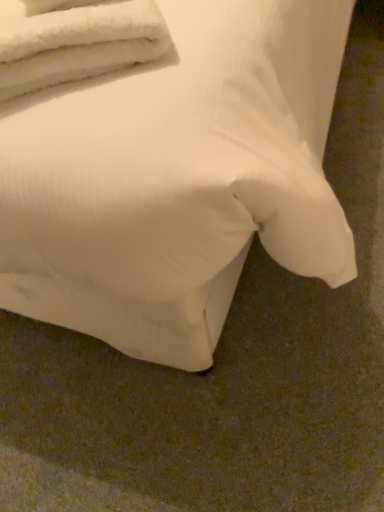
Image resolution: width=384 pixels, height=512 pixels. Describe the element at coordinates (176, 179) in the screenshot. I see `white fabric bed at center` at that location.

At what (x,y) coordinates should I click in order to perform the action: click on white fabric bed at center. Please return your answer as a coordinate pair (x, y). The height and width of the screenshot is (512, 384). Looking at the image, I should click on (176, 179).

Measure the distance between point (0, 91) and camera.

They are 60.60 centimeters apart.

This screenshot has width=384, height=512. What do you see at coordinates (78, 44) in the screenshot?
I see `white fluffy towels at upper left` at bounding box center [78, 44].

What is the approximate width of white fluffy towels at upper left?

14.81 inches.

Locate an element on the screen. white fluffy towels at upper left is located at coordinates (78, 44).

Locate an element on the screen. The image size is (384, 512). white fabric bed at center is located at coordinates (176, 179).

Which object is positioned more to the right, white fabric bed at center or white fluffy towels at upper left?

From the viewer's perspective, white fabric bed at center appears more on the right side.

Is white fabric bed at center behind white fluffy towels at upper left?

No, white fabric bed at center is closer to the camera.

Is point (80, 262) more distant than point (109, 12)?

Yes, it is behind point (109, 12).

From the image's perspective, who appears lower, white fabric bed at center or white fluffy towels at upper left?

white fluffy towels at upper left appears lower in the image.

From a real-world perspective, does white fabric bed at center stand above white fluffy towels at upper left?

No, from a real-world perspective, white fabric bed at center is not over white fluffy towels at upper left

Looking at their sizes, would you say white fabric bed at center is wider or thinner than white fluffy towels at upper left?

Clearly, white fabric bed at center has more width compared to white fluffy towels at upper left.

Is white fabric bed at center shorter than white fluffy towels at upper left?

No, white fabric bed at center is not shorter than white fluffy towels at upper left.

Is white fabric bed at center bigger than white fluffy towels at upper left?

Indeed, white fabric bed at center has a larger size compared to white fluffy towels at upper left.

Based on the photo, is white fabric bed at center inside or outside of white fluffy towels at upper left?

white fabric bed at center exists outside the volume of white fluffy towels at upper left.

Is white fabric bed at center in contact with white fluffy towels at upper left?

No, white fabric bed at center is not making contact with white fluffy towels at upper left.

Is white fabric bed at center oriented towards white fluffy towels at upper left?

Yes.

What's the angular difference between white fabric bed at center and white fluffy towels at upper left's facing directions?

The angle between the facing direction of white fabric bed at center and the facing direction of white fluffy towels at upper left is 35.9 degrees.

Find the location of a particular element. The image size is (384, 512). towel on the left of white fabric bed at center is located at coordinates (78, 44).

Does white fluffy towels at upper left appear on the right side of white fabric bed at center?

In fact, white fluffy towels at upper left is to the left of white fabric bed at center.

Is white fluffy towels at upper left further to camera compared to white fabric bed at center?

Yes, it is.

Which is behind, point (16, 88) or point (300, 77)?

Positioned behind is point (300, 77).

From the image's perspective, does white fluffy towels at upper left appear lower than white fabric bed at center?

Correct, white fluffy towels at upper left appears lower than white fabric bed at center in the image.

From a real-world perspective, does white fluffy towels at upper left stand above white fabric bed at center?

Yes.

Is white fluffy towels at upper left wider than white fabric bed at center?

In fact, white fluffy towels at upper left might be narrower than white fabric bed at center.

Considering the relative sizes of white fluffy towels at upper left and white fabric bed at center in the image provided, is white fluffy towels at upper left shorter than white fabric bed at center?

Yes.

Based on their sizes in the image, would you say white fluffy towels at upper left is bigger or smaller than white fabric bed at center?

Clearly, white fluffy towels at upper left is smaller in size than white fabric bed at center.

Is white fabric bed at center completely or partially inside white fluffy towels at upper left?

Actually, white fabric bed at center is outside white fluffy towels at upper left.

Can you see white fluffy towels at upper left touching white fabric bed at center?

There is a gap between white fluffy towels at upper left and white fabric bed at center.

Is white fluffy towels at upper left facing towards white fabric bed at center?

Yes.

How many degrees apart are the facing directions of white fluffy towels at upper left and white fabric bed at center?

They differ by 35.9 degrees in their facing directions.

Identify the location of towel above the white fabric bed at center (from a real-world perspective). (78, 44).

What are the coordinates of `bed located above the white fluffy towels at upper left (from the image's perspective)` in the screenshot? It's located at (x=176, y=179).

Locate an element on the screen. The height and width of the screenshot is (512, 384). towel to the left of white fabric bed at center is located at coordinates (78, 44).